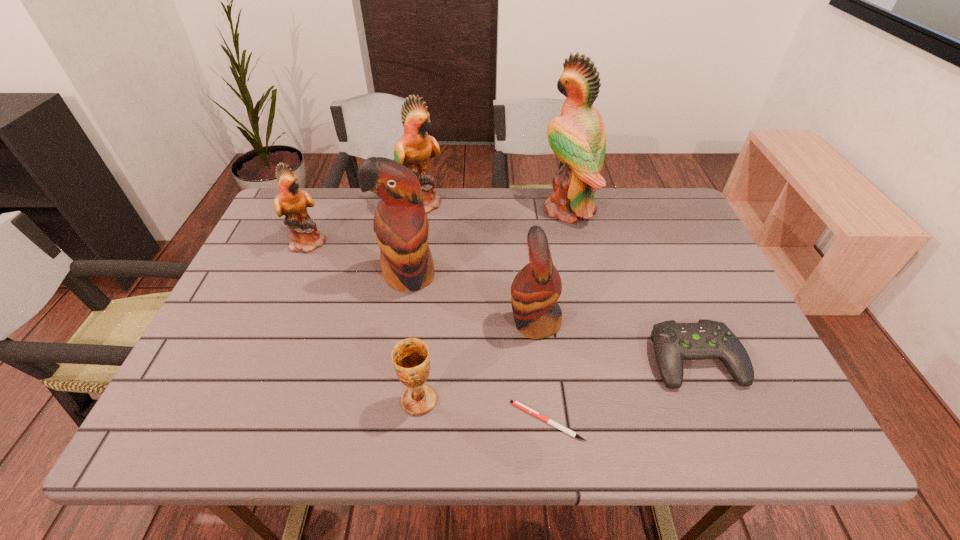
Where is `the biggest green parrot`? The image size is (960, 540). the biggest green parrot is located at coordinates (578, 138).

The image size is (960, 540). Find the location of `the tallest object`. the tallest object is located at coordinates (578, 138).

This screenshot has height=540, width=960. In order to click on the second smallest green parrot in this screenshot , I will do `click(413, 149)`.

Where is `the farther red parrot`? The width and height of the screenshot is (960, 540). the farther red parrot is located at coordinates (401, 228).

I want to click on the left red parrot, so click(401, 228).

Locate an element on the screen. the leftmost object is located at coordinates (292, 202).

At what (x,y) coordinates should I click in order to perform the action: click on the leftmost green parrot. Please return your answer as a coordinate pair (x, y). Looking at the image, I should click on (292, 202).

Where is `the smaller red parrot`? Image resolution: width=960 pixels, height=540 pixels. the smaller red parrot is located at coordinates (536, 288).

You are a GUI agent. You are given a task and a screenshot of the screen. Output one action in this format:
    pyautogui.click(x=<x>, y=<y>)
    Task: Click on the nearest parrot
    The image size is (960, 540).
    Given the screenshot: What is the action you would take?
    pyautogui.click(x=536, y=288)

The image size is (960, 540). Find the location of `the sixth tallest object`. the sixth tallest object is located at coordinates (410, 357).